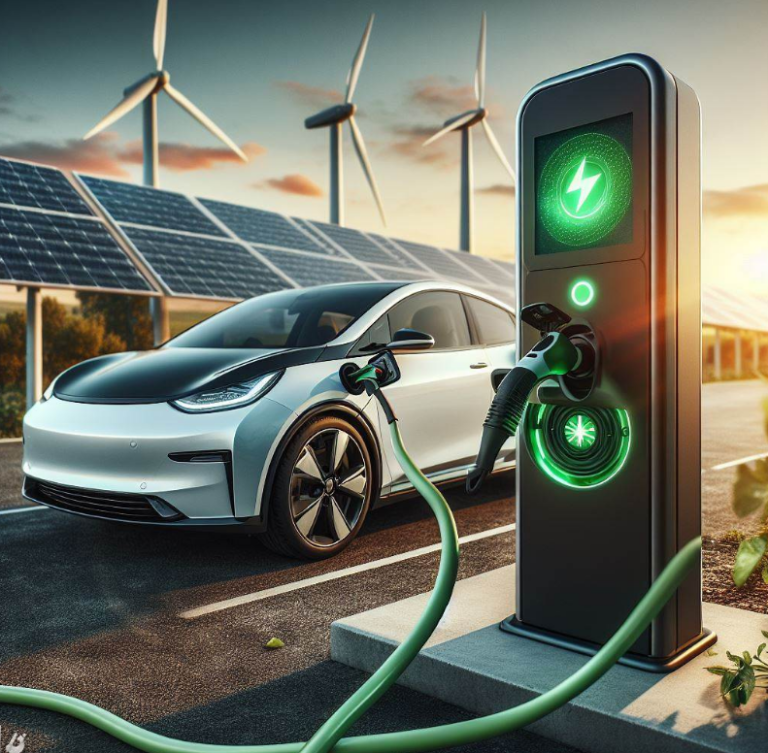
The width and height of the screenshot is (768, 753). In order to click on light in this screenshot , I will do `click(580, 209)`.